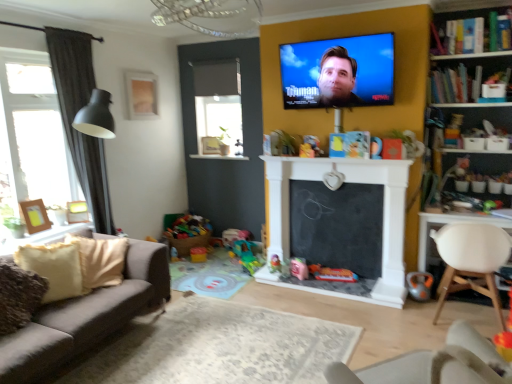
Where is `free spot above black chalkboard at center (from a real-world perspective)`? free spot above black chalkboard at center (from a real-world perspective) is located at coordinates (325, 179).